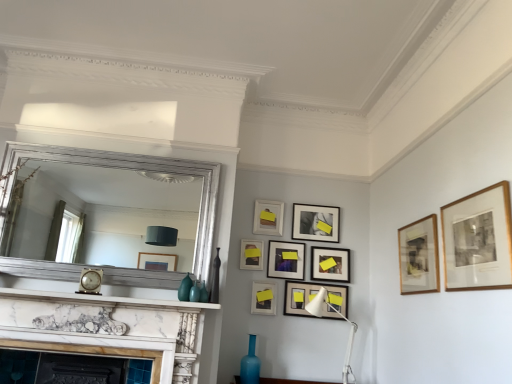
Locate an element on the screen. This screenshot has width=512, height=384. free location above silver metallic mirror at upper center (from a real-world perspective) is located at coordinates (138, 148).